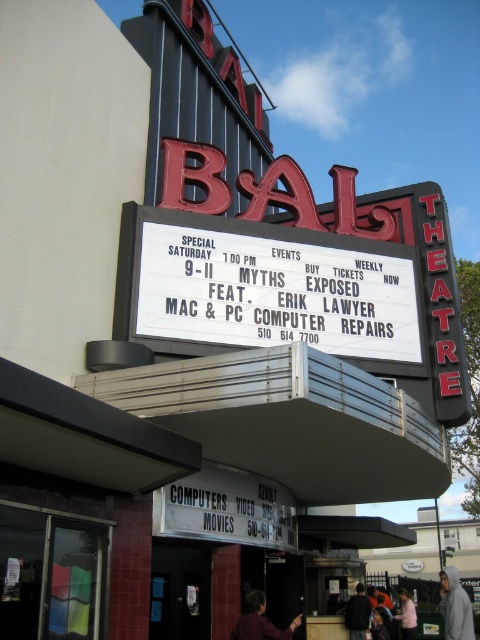
You are a theater patron standing at the entrance of Bali Theatre. You see the white matte sign at center and the white hoodie at lower right. Which object takes up more visual space in the scene?

The white hoodie at lower right takes up more visual space in the scene because the white matte sign at center occupies less space than white hoodie at lower right.

You are a theatergoer standing in front of Bali Theatre. You notice the white matte sign at center and the pink fabric shirt at lower right. Which object is bigger?

The white matte sign at center is larger in size than the pink fabric shirt at lower right.